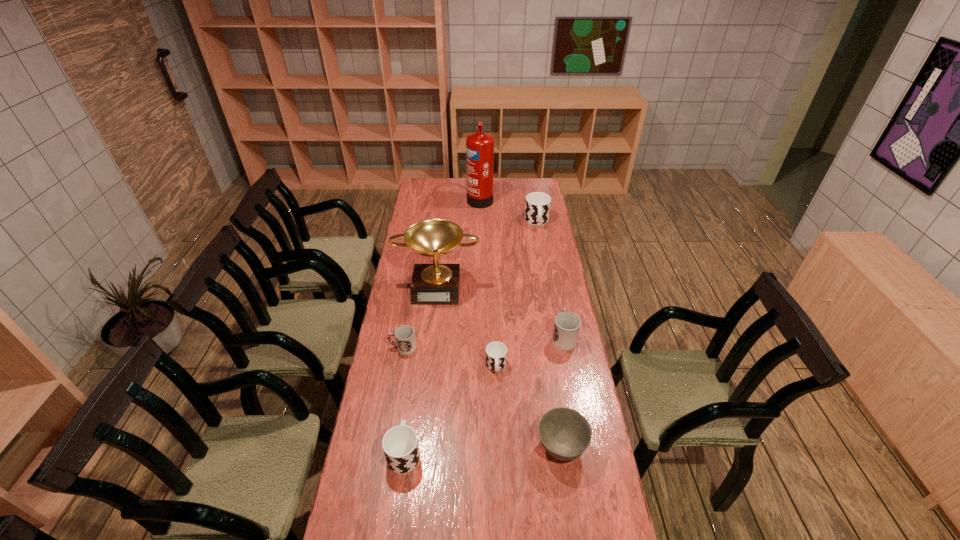
Image resolution: width=960 pixels, height=540 pixels. What are the coordinates of `object that is the fifth nearest to the nearest cup` in the screenshot? It's located at (432, 284).

Identify which cup is located as the nearest to the bigger red cup. Please provide its 2D coordinates. Your answer should be formatted as a tuple, i.e. [(x, y)], where the tuple contains the x and y coordinates of a point satisfying the conditions above.

[(496, 352)]

I want to click on cup that is the third closest to the third farthest object, so click(566, 329).

The width and height of the screenshot is (960, 540). I want to click on the closest black cup to the fire extinguisher, so click(x=537, y=208).

Locate an element on the screen. black cup that stands as the third closest to the bowl is located at coordinates (537, 208).

What are the coordinates of `vacant point that satisfies the following two spatial constraints: 1. on the surface of the red fire extinguisher; 2. on the handle side of the bigger red cup` in the screenshot? It's located at (480, 336).

This screenshot has height=540, width=960. In order to click on vacant space that satisfies the following two spatial constraints: 1. on the side of the leftmost black cup with the handle; 2. on the right side of the bowl in this screenshot , I will do `click(405, 447)`.

The height and width of the screenshot is (540, 960). I want to click on free space that satisfies the following two spatial constraints: 1. on the side of the bowl with the handle; 2. on the right side of the third cup from left to right, so click(498, 447).

Image resolution: width=960 pixels, height=540 pixels. Identify the location of vacant space that satisfies the following two spatial constraints: 1. on the front-facing side of the bowl; 2. on the right side of the award. (420, 447).